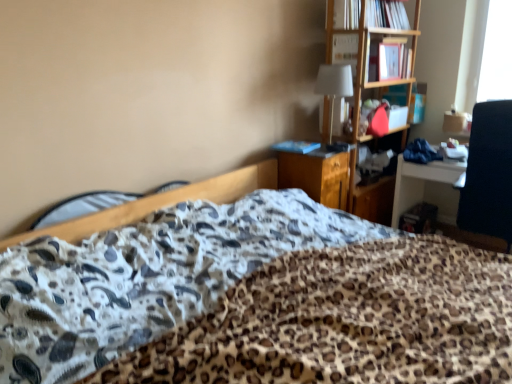
Question: From the image's perspective, relative to wooden file cabinet at center, is white fabric lampshade at upper center above or below?

Choices:
 (A) above
 (B) below

Answer: (A)

Question: Looking at their shapes, would you say white fabric lampshade at upper center is wider or thinner than wooden file cabinet at center?

Choices:
 (A) wide
 (B) thin

Answer: (B)

Question: Estimate the real-world distances between objects in this image. Which object is closer to the hardcover book at upper right, the first book from the top?

Choices:
 (A) wooden bed frame at center
 (B) wooden file cabinet at center
 (C) matte pink book at upper right, the 1th book when ordered from right to left
 (D) blue matte book at center, positioned as the first book in left-to-right order
 (E) white fabric lampshade at upper center

Answer: (C)

Question: Which is nearer to the hardcover book at upper right, the first book from the top?

Choices:
 (A) matte pink book at upper right, the 3th book in the left-to-right sequence
 (B) wooden file cabinet at center
 (C) blue matte book at center, which is counted as the 3th book, starting from the right
 (D) white fabric lampshade at upper center
 (E) wooden bed frame at center

Answer: (A)